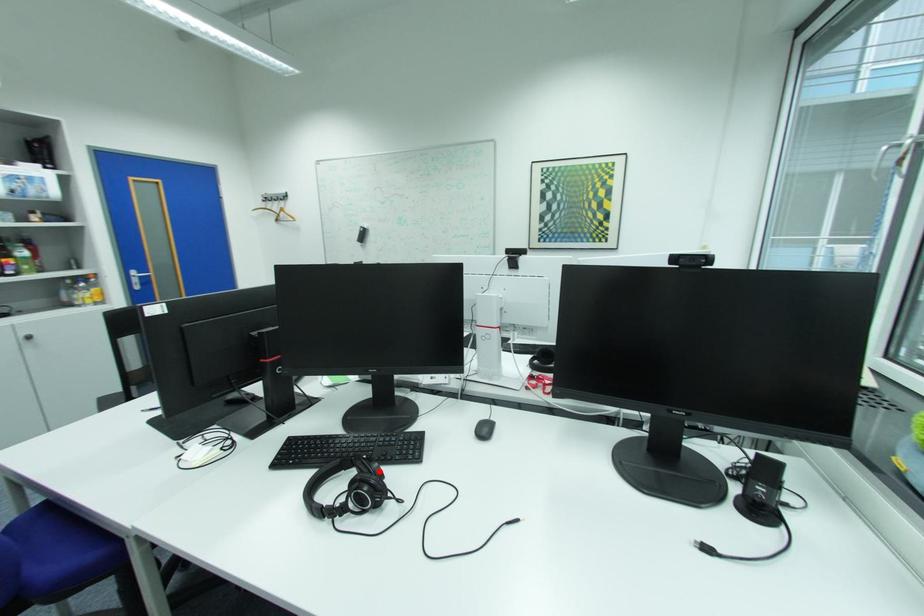
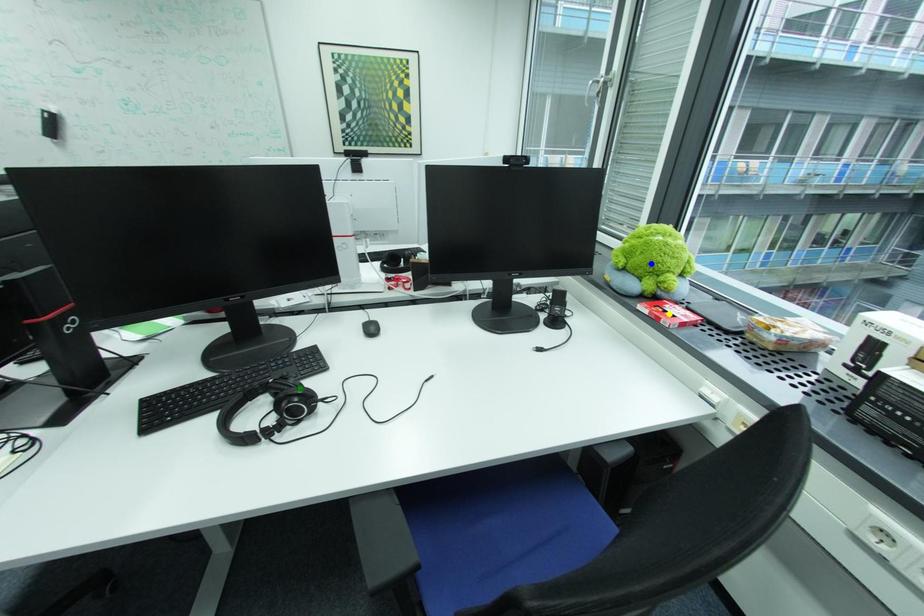
Question: I am providing you with two images of the same scene from different viewpoints. A red point is marked on the first image. You are given multiple points on the second image. Which spot in image 2 lines up with the point in image 1?

Choices:
 (A) blue point
 (B) green point
 (C) yellow point

Answer: (B)